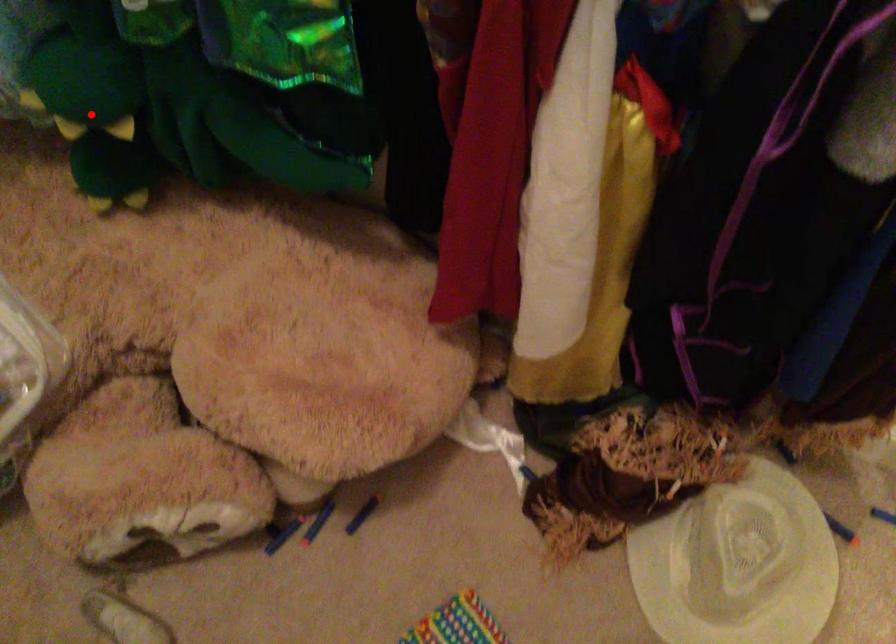
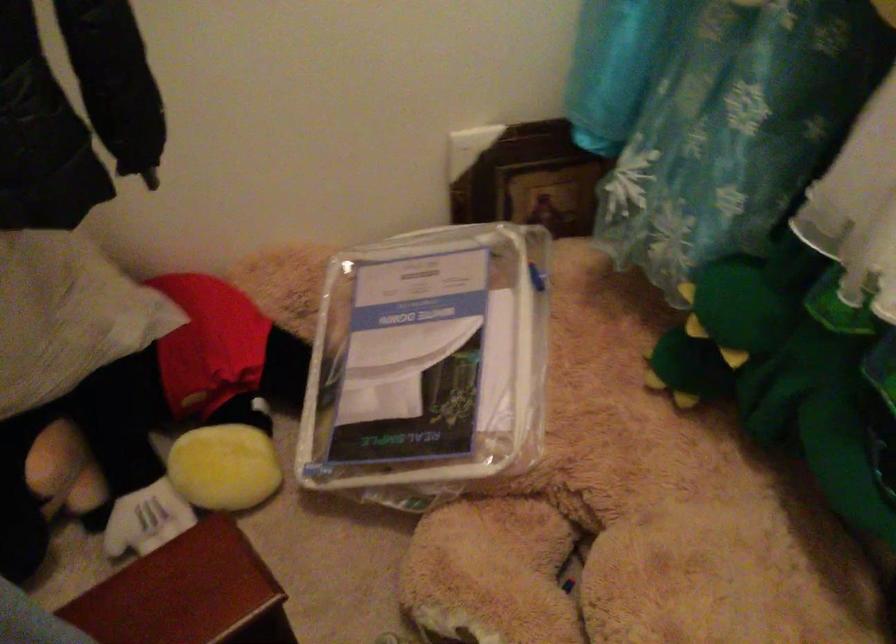
Where in the second image is the point corresponding to the highlighted location from the first image?

(719, 330)